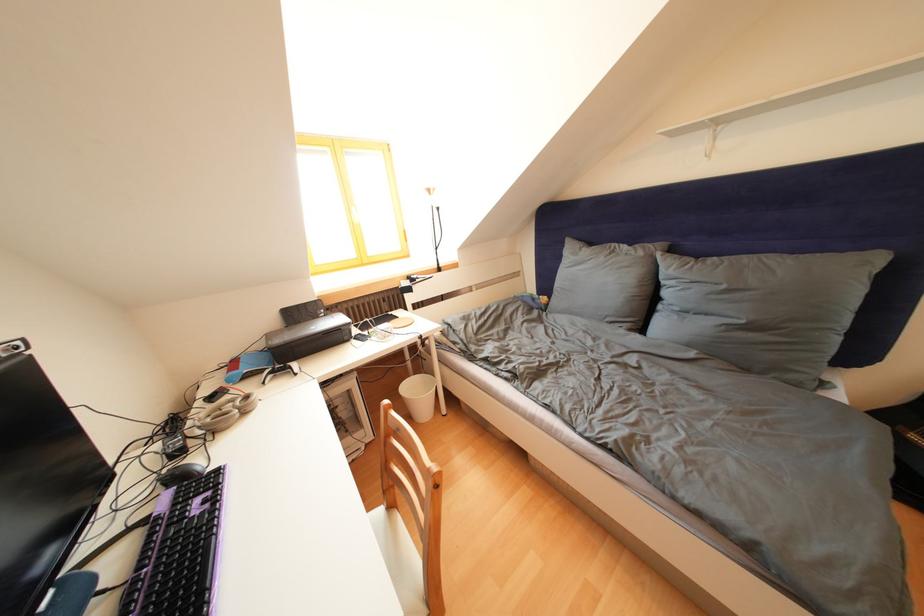
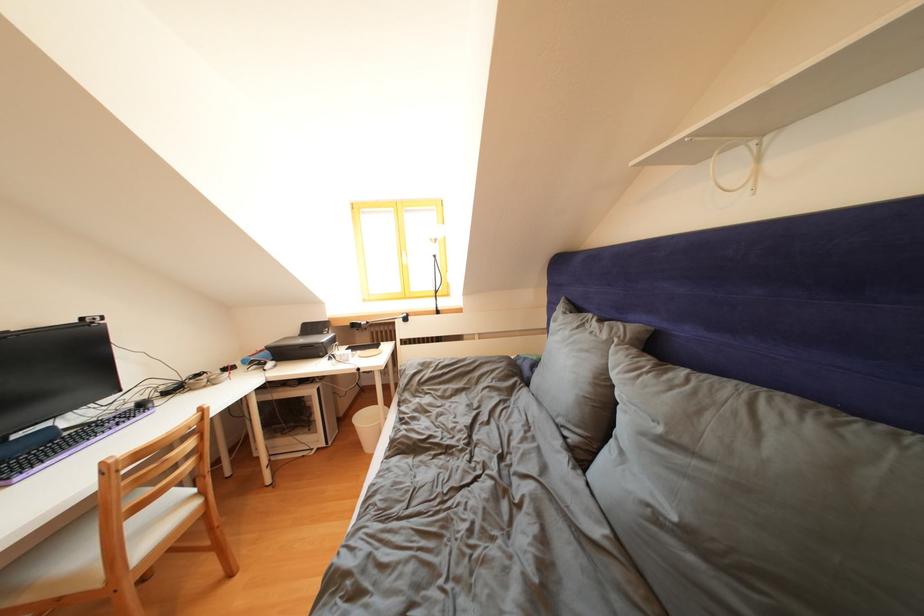
Locate, in the second image, the point that corresponds to the point at 302,318 in the first image.

(319, 333)